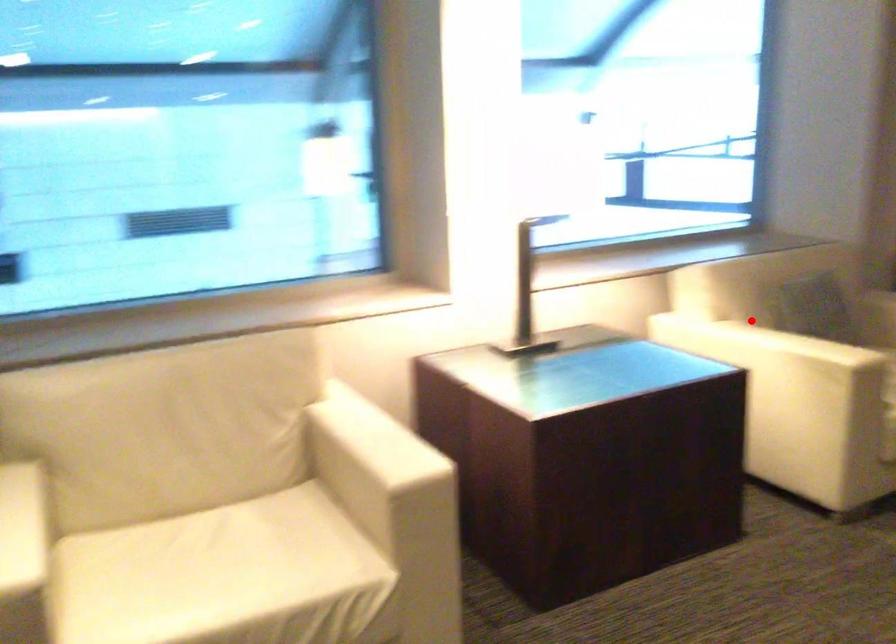
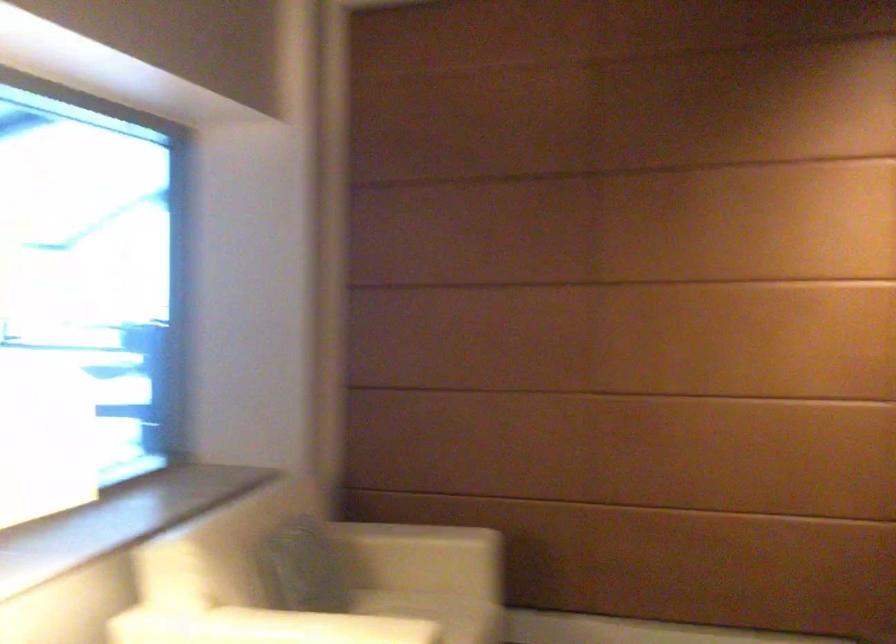
Question: I am providing you with two images of the same scene from different viewpoints. Given a red point in image1, look at the same physical point in image2. Is it:

Choices:
 (A) Closer to the viewpoint
 (B) Farther from the viewpoint

Answer: (A)